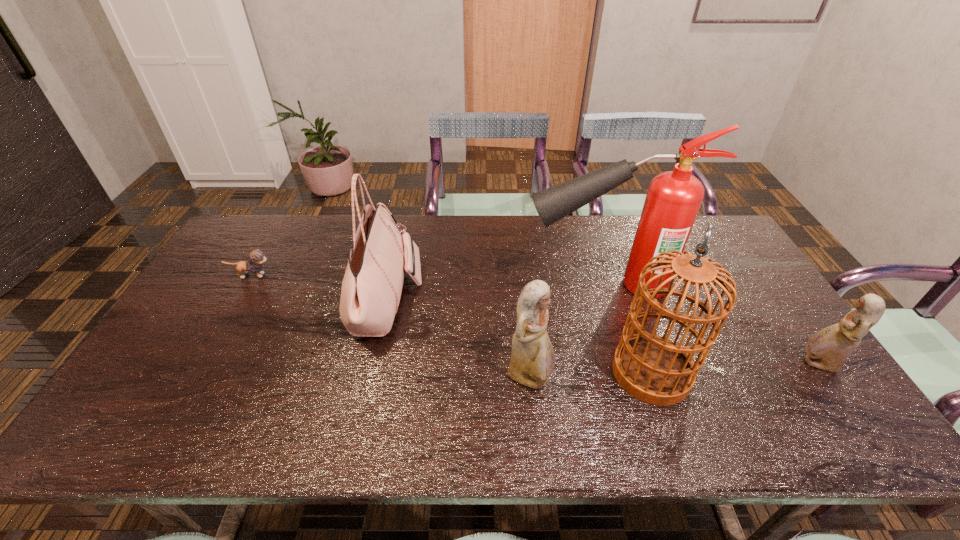
Locate an element on the screen. This screenshot has height=540, width=960. birdcage situated at the near edge is located at coordinates (653, 369).

Locate an element on the screen. This screenshot has height=540, width=960. object that is positioned at the left edge is located at coordinates (257, 257).

Identify the location of object that is at the right edge. (828, 349).

The image size is (960, 540). Find the location of `object that is positioned at the near right corner`. object that is positioned at the near right corner is located at coordinates (828, 349).

At what (x,y) coordinates should I click in order to perform the action: click on blank area at the far edge. Please return your answer as a coordinate pair (x, y). Image resolution: width=960 pixels, height=540 pixels. Looking at the image, I should click on (574, 224).

You are a GUI agent. You are given a task and a screenshot of the screen. Output one action in this format:
    pyautogui.click(x=<x>, y=<y>)
    Task: Click on the vacant space at the near edge of the desktop
    This screenshot has height=540, width=960.
    Given the screenshot: What is the action you would take?
    coord(436,390)

Locate an element on the screen. free space at the left edge of the desktop is located at coordinates (211, 287).

Identify the location of free location at the right edge of the desktop. This screenshot has height=540, width=960. (765, 307).

Find the location of a particular element. The image size is (960, 540). vacant space that's between the third shortest object and the fire extinguisher is located at coordinates (567, 332).

Locate an element on the screen. vacant region between the handbag and the fire extinguisher is located at coordinates (495, 292).